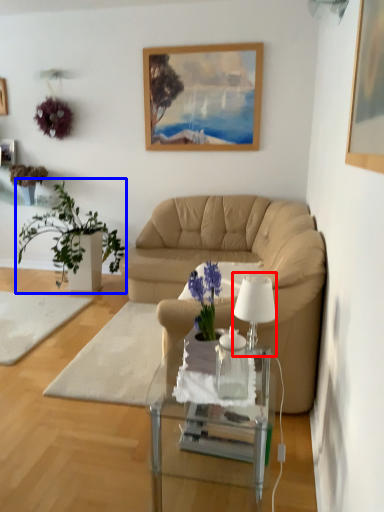
Question: Which of the following is the farthest to the observer, lamp (highlighted by a red box) or houseplant (highlighted by a blue box)?

Choices:
 (A) lamp
 (B) houseplant

Answer: (B)